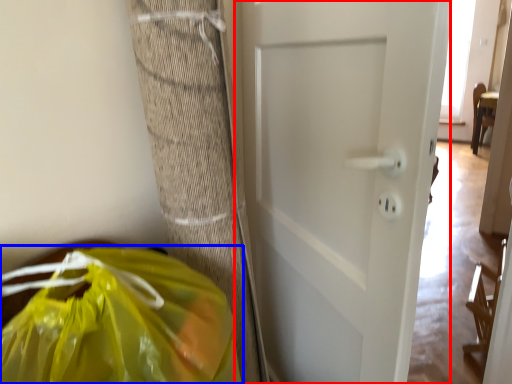
Question: Among these objects, which one is farthest to the camera, door (highlighted by a red box) or plastic bag (highlighted by a blue box)?

Choices:
 (A) door
 (B) plastic bag

Answer: (A)